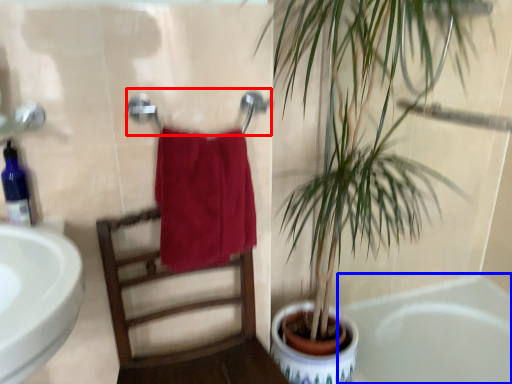
Question: Which point is further to the camera, towel bar (highlighted by a red box) or bathtub (highlighted by a blue box)?

Choices:
 (A) towel bar
 (B) bathtub

Answer: (B)